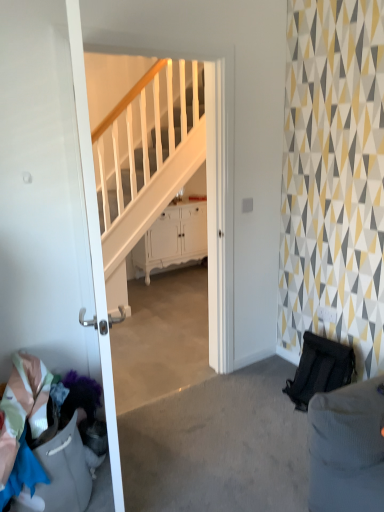
What do you see at coordinates (173, 239) in the screenshot?
I see `white glossy cabinet at center` at bounding box center [173, 239].

Describe the element at coordinates (50, 202) in the screenshot. The height and width of the screenshot is (512, 384). I see `white glossy door at left` at that location.

Identify the location of multicolored fabric at lower left. This screenshot has width=384, height=512. coord(40,447).

Considering their positions, is white glossy cabinet at center located in front of or behind white glossy door at left?

white glossy cabinet at center is behind white glossy door at left.

Can you confirm if white glossy cabinet at center is wider than white glossy door at left?

Yes.

Between point (145, 234) and point (20, 21), which one is positioned behind?

Point (145, 234)

Is white glossy cabinet at center bigger than white glossy door at left?

Correct, white glossy cabinet at center is larger in size than white glossy door at left.

The width and height of the screenshot is (384, 512). I want to click on laundry lying below the white glossy cabinet at center (from the image's perspective), so click(40, 447).

Who is taller, multicolored fabric at lower left or white glossy cabinet at center?

Standing taller between the two is white glossy cabinet at center.

Is multicolored fabric at lower left behind white glossy cabinet at center?

No, multicolored fabric at lower left is in front of white glossy cabinet at center.

Looking at this image, does multicolored fabric at lower left appear on the left side of white glossy door at left?

Correct, you'll find multicolored fabric at lower left to the left of white glossy door at left.

Are multicolored fabric at lower left and white glossy door at left far apart?

No, multicolored fabric at lower left is not far from white glossy door at left.

Does multicolored fabric at lower left have a larger size compared to white glossy door at left?

No.

Are white glossy cabinet at center and multicolored fabric at lower left making contact?

No.

From a real-world perspective, is white glossy cabinet at center positioned above or below multicolored fabric at lower left?

Clearly, from a real-world perspective, white glossy cabinet at center is above multicolored fabric at lower left.

From the image's perspective, is white glossy cabinet at center above or below multicolored fabric at lower left?

Clearly, from the image's perspective, white glossy cabinet at center is above multicolored fabric at lower left.

Which object is positioned more to the right, white glossy door at left or multicolored fabric at lower left?

white glossy door at left.

Is the position of white glossy door at left more distant than that of multicolored fabric at lower left?

No.

Is there a large distance between white glossy door at left and multicolored fabric at lower left?

No, white glossy door at left is in close proximity to multicolored fabric at lower left.

Where is `door on the right of multicolored fabric at lower left`? The width and height of the screenshot is (384, 512). door on the right of multicolored fabric at lower left is located at coordinates (50, 202).

Based on the photo, does white glossy door at left come behind white glossy cabinet at center?

That is False.

How different are the orientations of white glossy door at left and white glossy cabinet at center in degrees?

There is a 68.4-degree angle between the facing directions of white glossy door at left and white glossy cabinet at center.

Consider the image. Which is nearer, (36, 288) or (172, 264)?

The point (36, 288) is more forward.

At what (x,y) coordinates should I click in order to perform the action: click on door on the left of the white glossy cabinet at center. Please return your answer as a coordinate pair (x, y). The width and height of the screenshot is (384, 512). Looking at the image, I should click on (50, 202).

Find the location of `cabinetry that is above the multicolored fabric at lower left (from a real-world perspective)`. cabinetry that is above the multicolored fabric at lower left (from a real-world perspective) is located at coordinates (173, 239).

Considering their positions, is white glossy door at left positioned further to multicolored fabric at lower left than white glossy cabinet at center?

Based on the image, white glossy cabinet at center appears to be further to multicolored fabric at lower left.

Based on the photo, which object lies further to the anchor point white glossy door at left, white glossy cabinet at center or multicolored fabric at lower left?

The object further to white glossy door at left is white glossy cabinet at center.

Which object lies further to the anchor point white glossy door at left, multicolored fabric at lower left or white glossy cabinet at center?

white glossy cabinet at center.

Which object lies further to the anchor point white glossy cabinet at center, white glossy door at left or multicolored fabric at lower left?

multicolored fabric at lower left is further to white glossy cabinet at center.

Which object lies further to the anchor point multicolored fabric at lower left, white glossy cabinet at center or white glossy door at left?

white glossy cabinet at center is positioned further to the anchor multicolored fabric at lower left.

Looking at the image, which one is located closer to white glossy cabinet at center, multicolored fabric at lower left or white glossy door at left?

white glossy door at left is positioned closer to the anchor white glossy cabinet at center.

You are a GUI agent. You are given a task and a screenshot of the screen. Output one action in this format:
    pyautogui.click(x=<x>, y=<y>)
    Task: Click on the laundry between white glossy door at left and white glossy cabinet at center in the front-back direction
    This screenshot has width=384, height=512.
    Given the screenshot: What is the action you would take?
    pyautogui.click(x=40, y=447)